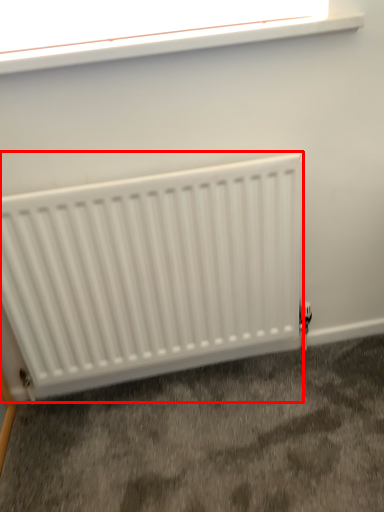
Question: Where is radiator (annotated by the red box) located in relation to window in the image?

Choices:
 (A) left
 (B) right

Answer: (A)